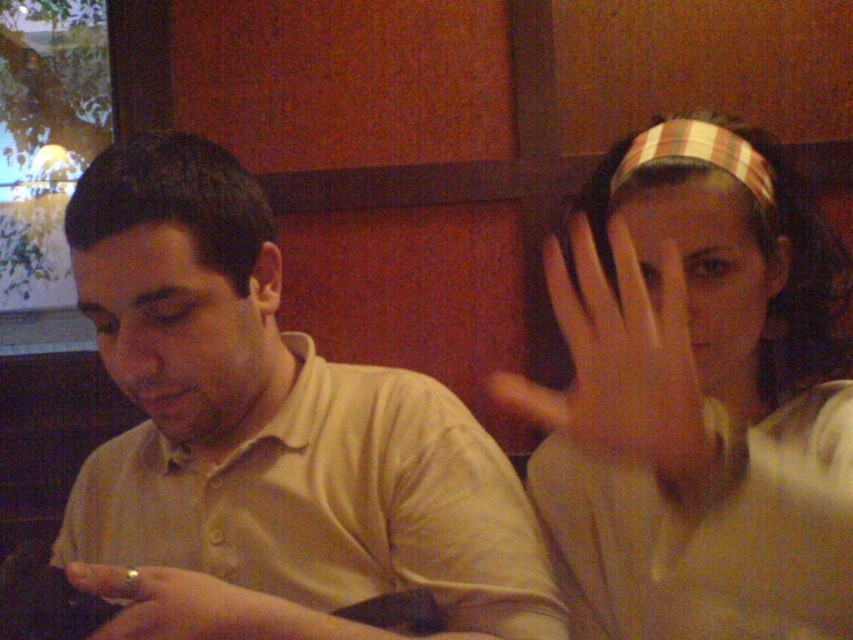
Does point (712, 564) lie behind point (607, 454)?

That is False.

What do you see at coordinates (695, 397) in the screenshot? The height and width of the screenshot is (640, 853). I see `striped fabric headband at upper right` at bounding box center [695, 397].

Locate an element on the screen. The width and height of the screenshot is (853, 640). striped fabric headband at upper right is located at coordinates (695, 397).

Does striped fabric headband at upper right have a greater height compared to gold ring at lower left?

Indeed, striped fabric headband at upper right has a greater height compared to gold ring at lower left.

Does point (624, 636) come in front of point (201, 618)?

No, it is behind (201, 618).

Identify the location of striped fabric headband at upper right. The image size is (853, 640). (695, 397).

Locate an element on the screen. beige cotton shirt at left is located at coordinates (268, 433).

How distant is beige cotton shirt at left from striped fabric headband at upper right?

beige cotton shirt at left is 10.67 inches away from striped fabric headband at upper right.

Find the location of a particular element. The height and width of the screenshot is (640, 853). beige cotton shirt at left is located at coordinates point(268,433).